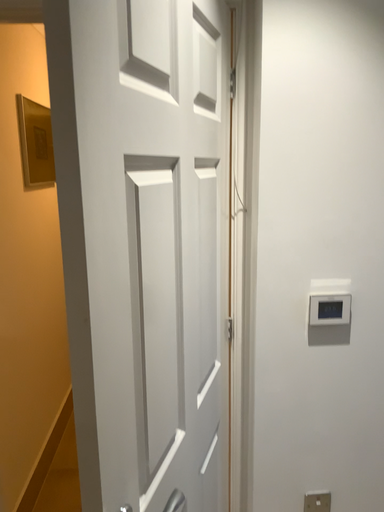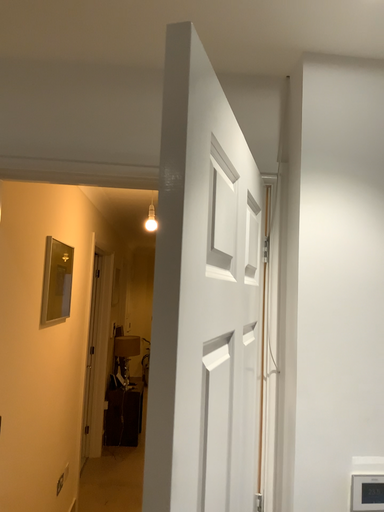
Question: How did the camera likely rotate when shooting the video?

Choices:
 (A) rotated downward
 (B) rotated upward

Answer: (B)